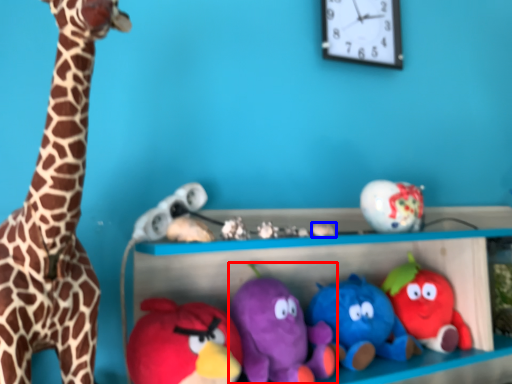
Question: Which of the following is the farthest to the observer, toy (highlighted by a red box) or toy (highlighted by a blue box)?

Choices:
 (A) toy
 (B) toy

Answer: (B)